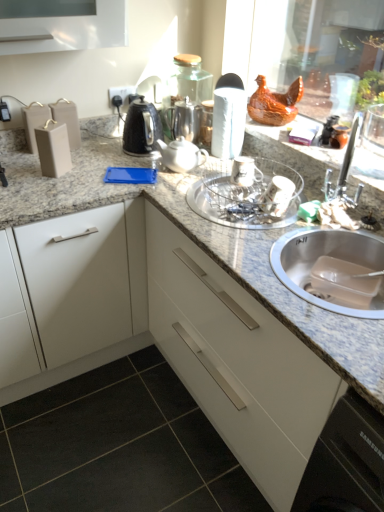
Question: Is point (188, 136) positioned closer to the camera than point (38, 138)?

Choices:
 (A) farther
 (B) closer

Answer: (A)

Question: Would you say satin silver teapot at center, positioned as the 2th tea pot in front-to-back order, is to the left or to the right of matte gray box at left, which is the 1th appliance from left to right, in the picture?

Choices:
 (A) left
 (B) right

Answer: (B)

Question: Which is nearer to the black glossy kettle at center?

Choices:
 (A) clear glass bowl at center
 (B) white matte cabinet at center, marked as the 2th cabinetry in a left-to-right arrangement
 (C) silver metallic sink at lower right
 (D) white glossy teapot at center, the 1th tea pot from the front
 (E) matte gray box at left, which is the 1th appliance from left to right

Answer: (D)

Question: Which object is positioned farthest from the clear glass bowl at center?

Choices:
 (A) white matte cabinet at center, marked as the 2th cabinetry in a left-to-right arrangement
 (B) matte gray box at left, marked as the 2th appliance in a right-to-left arrangement
 (C) satin silver teapot at center, positioned as the 2th tea pot in front-to-back order
 (D) black glossy kettle at center
 (E) white glossy teapot at center, the 1th tea pot from the front

Answer: (B)